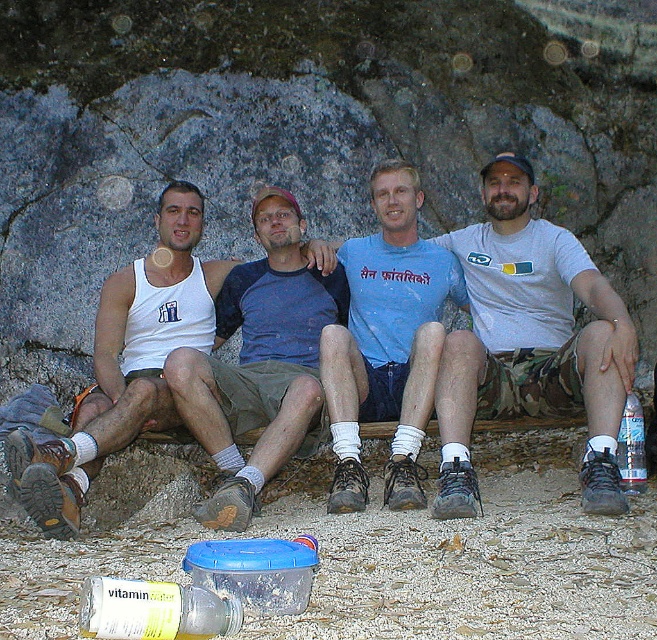
What are the coordinates of the blue cotton shirt at center?

The blue cotton shirt at center is located at coordinates point (386,340).

Based on the photo, you are standing at the point labeled point (380, 332) and want to move to the point labeled point (191, 376). Which direction should you move to reach your destination?

You should move forward to reach point (191, 376) because it is in front of point (380, 332).